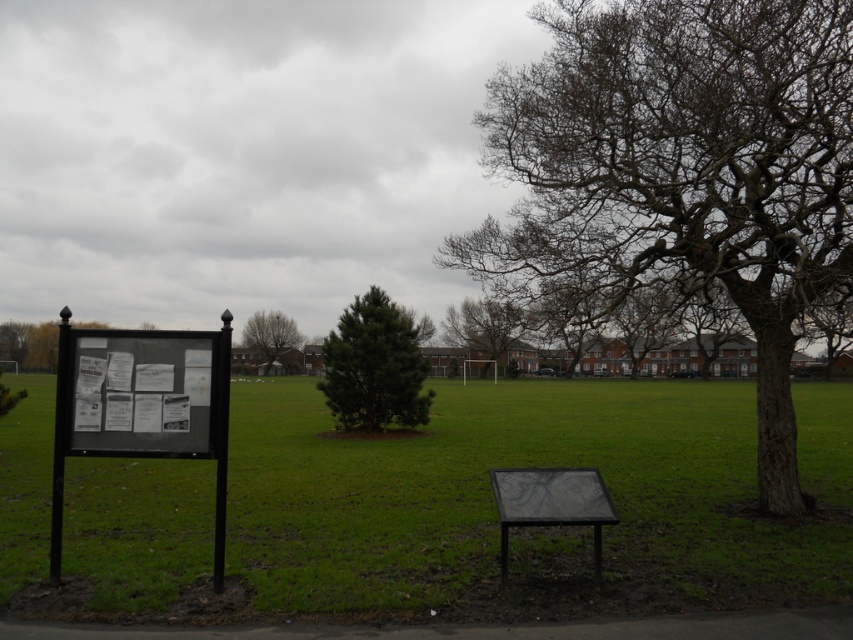
Which is more to the right, green needle-like tree at center or brown textured tree at center?

Positioned to the right is brown textured tree at center.

Between green needle-like tree at center and brown textured tree at center, which one is positioned higher?

green needle-like tree at center is above.

This screenshot has height=640, width=853. Identify the location of green needle-like tree at center. (376, 365).

Does black matte signboard at left appear on the right side of green needle-like tree at center?

No, black matte signboard at left is not to the right of green needle-like tree at center.

You are a GUI agent. You are given a task and a screenshot of the screen. Output one action in this format:
    pyautogui.click(x=<x>, y=<y>)
    Task: Click on the black matte signboard at left
    The width and height of the screenshot is (853, 640).
    Given the screenshot: What is the action you would take?
    pyautogui.click(x=494, y=502)

Is green needle-like tree at center bigger than green leafy tree at center?

Yes, green needle-like tree at center is bigger than green leafy tree at center.

From the picture: Does green needle-like tree at center have a greater height compared to green leafy tree at center?

Yes, green needle-like tree at center is taller than green leafy tree at center.

Where is `green needle-like tree at center`? The width and height of the screenshot is (853, 640). green needle-like tree at center is located at coordinates (x=376, y=365).